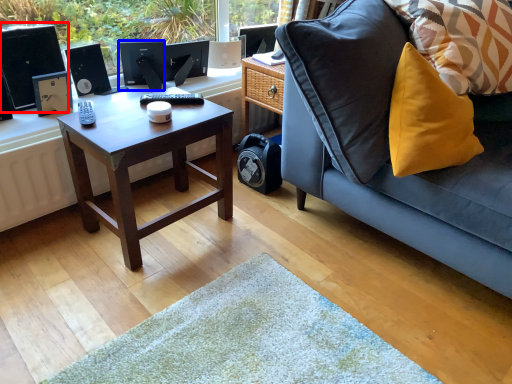
Question: Which of the following is the farthest to the observer, desktop computer (highlighted by a red box) or computer monitor (highlighted by a blue box)?

Choices:
 (A) desktop computer
 (B) computer monitor

Answer: (B)